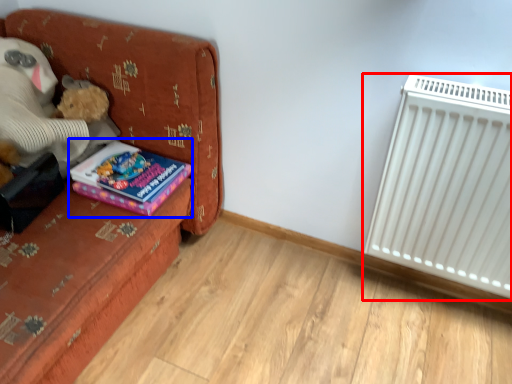
Question: Which of the following is the farthest to the observer, radiator (highlighted by a red box) or book (highlighted by a blue box)?

Choices:
 (A) radiator
 (B) book

Answer: (B)